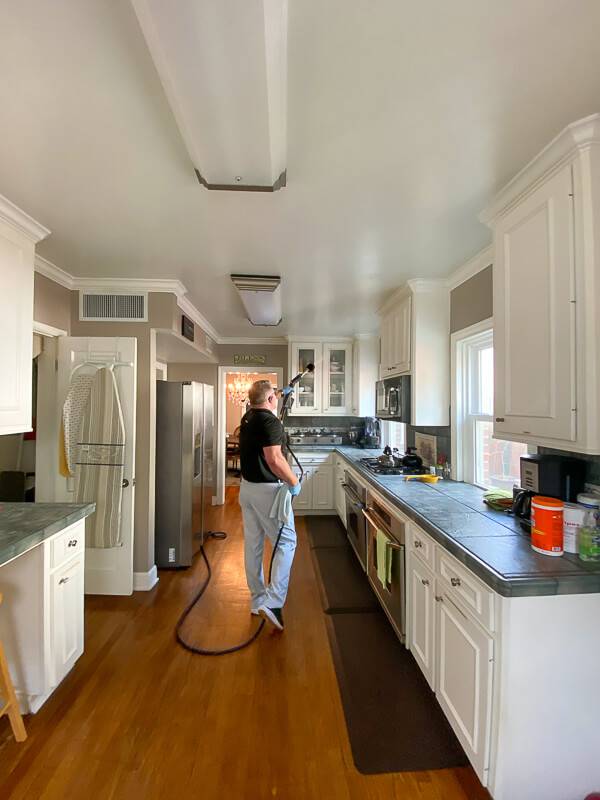
Where is `container on countertop`? container on countertop is located at coordinates (540, 530), (569, 530).